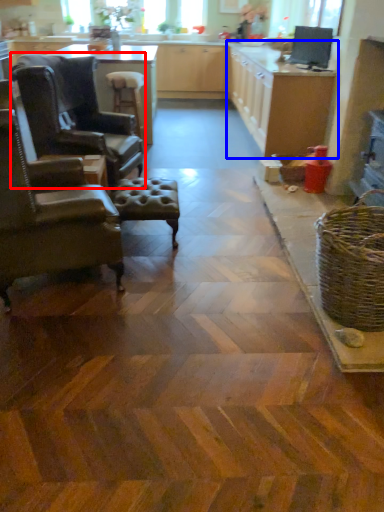
Question: Which of the following is the farthest to the observer, chair (highlighted by a red box) or cabinetry (highlighted by a blue box)?

Choices:
 (A) chair
 (B) cabinetry

Answer: (B)